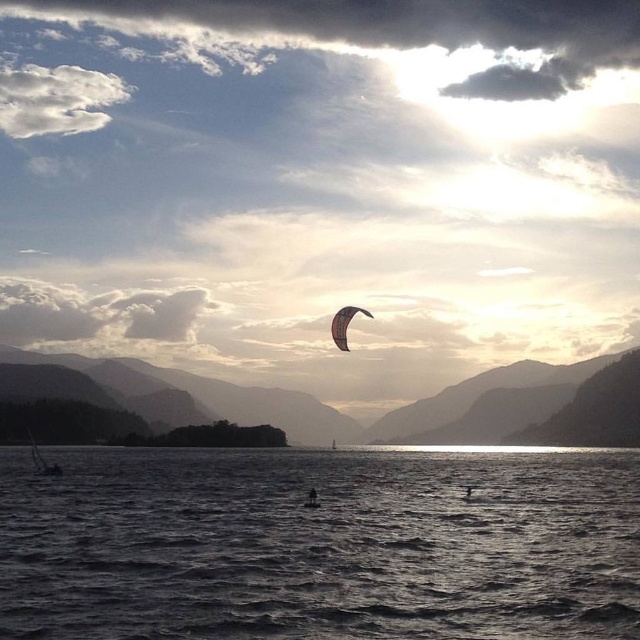
Is dark skin person at center positioned behind silhouette of person at center?

No, it is in front of silhouette of person at center.

Between dark skin person at center and silhouette of person at center, which one is positioned higher?

Positioned higher is dark skin person at center.

Between point (305, 506) and point (470, 490), which one is positioned in front?

Point (305, 506) is more forward.

Identify the location of dark skin person at center. (310, 499).

Which is behind, point (157, 605) or point (472, 492)?

The point (472, 492) is behind.

Between dark gray water at center and silhouette of person at center, which one has less height?

silhouette of person at center

Which is in front, point (243, 531) or point (468, 490)?

Point (243, 531) is more forward.

Locate an element on the screen. The width and height of the screenshot is (640, 640). dark gray water at center is located at coordinates (320, 545).

From the picture: Who is taller, dark gray water at center or dark skin person at center?

dark gray water at center

Image resolution: width=640 pixels, height=640 pixels. What do you see at coordinates (320, 545) in the screenshot?
I see `dark gray water at center` at bounding box center [320, 545].

Between point (392, 621) and point (316, 499), which one is positioned behind?

The point (316, 499) is behind.

You are a GUI agent. You are given a task and a screenshot of the screen. Output one action in this format:
    pyautogui.click(x=<x>, y=<y>)
    Task: Click on the dark gray water at center
    The height and width of the screenshot is (640, 640).
    Given the screenshot: What is the action you would take?
    pyautogui.click(x=320, y=545)